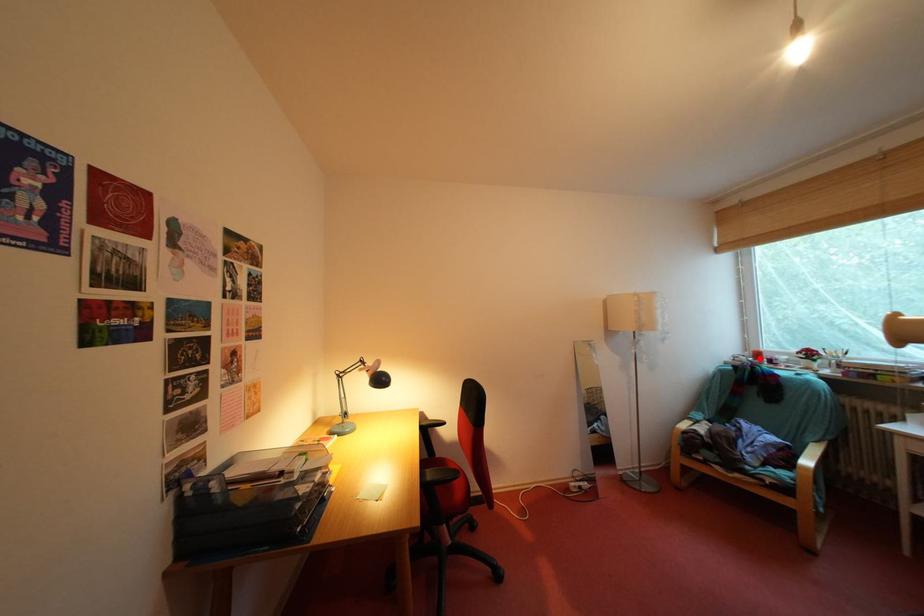
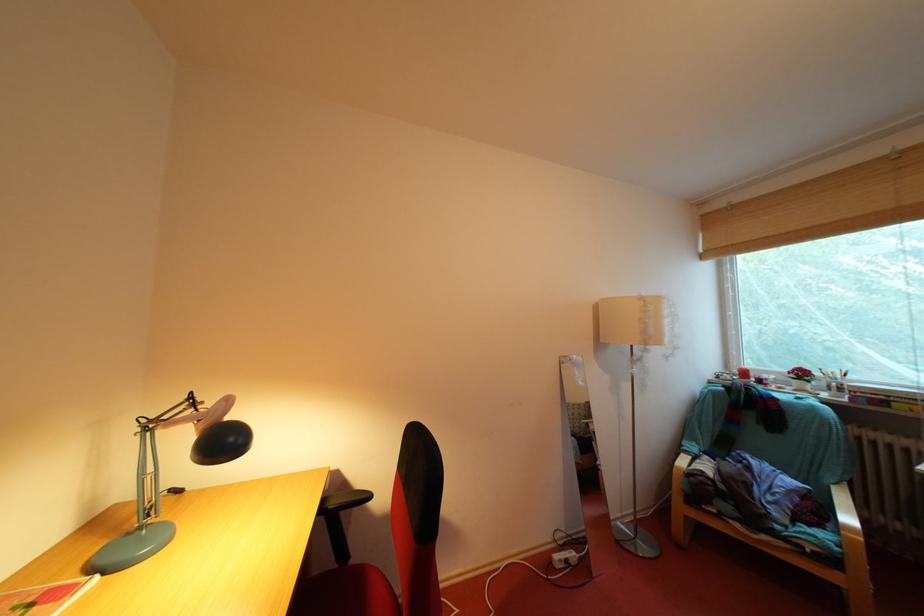
In the second image, find the point that corresponds to the highlighted location in the first image.

(746, 377)